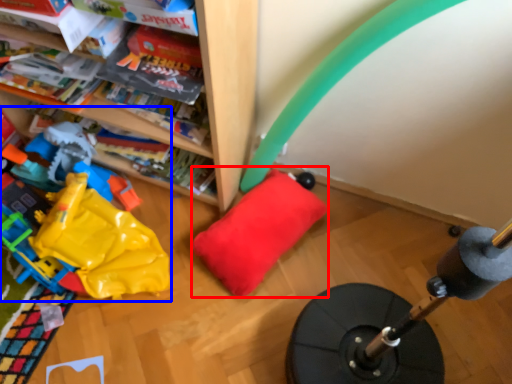
Question: Among these objects, which one is farthest to the camera, pillow (highlighted by a red box) or toy (highlighted by a blue box)?

Choices:
 (A) pillow
 (B) toy

Answer: (A)